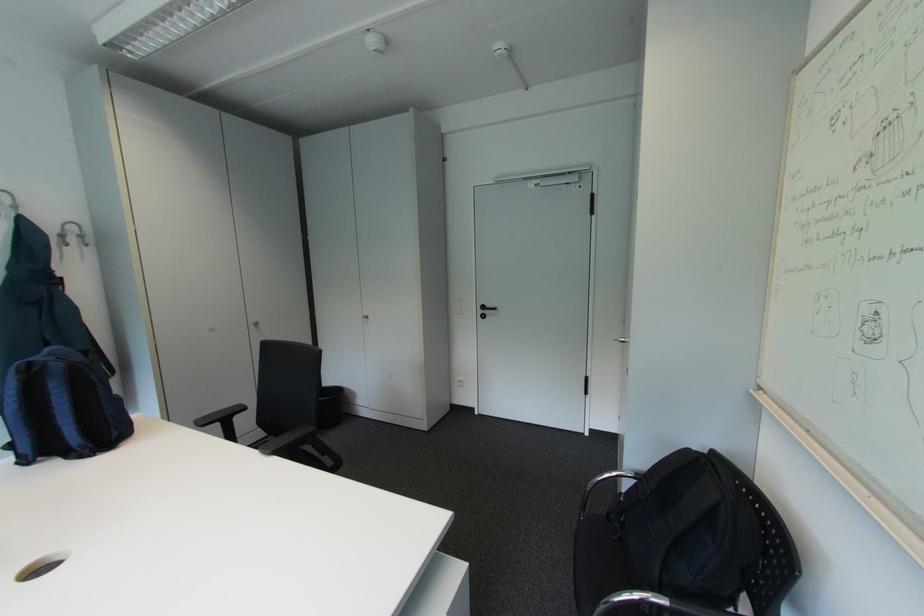
Where is `black chair armrest`? The width and height of the screenshot is (924, 616). black chair armrest is located at coordinates (219, 415).